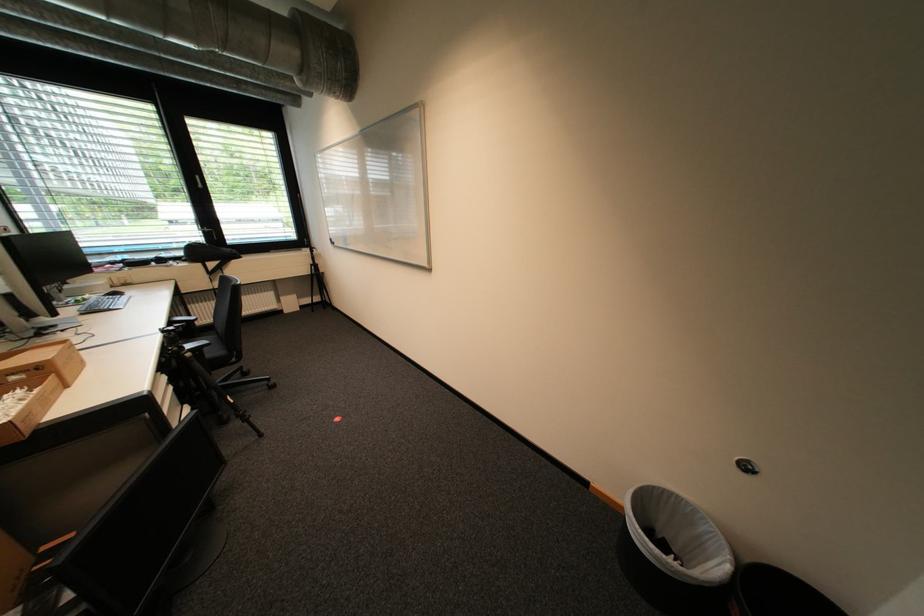
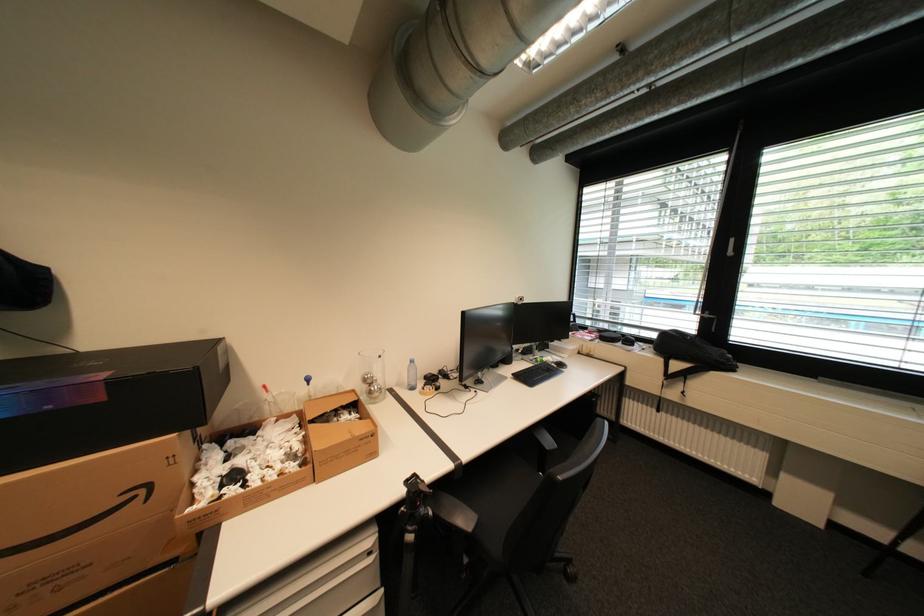
Locate, in the second image, the point that corresponds to point (78, 349) in the first image.

(370, 440)